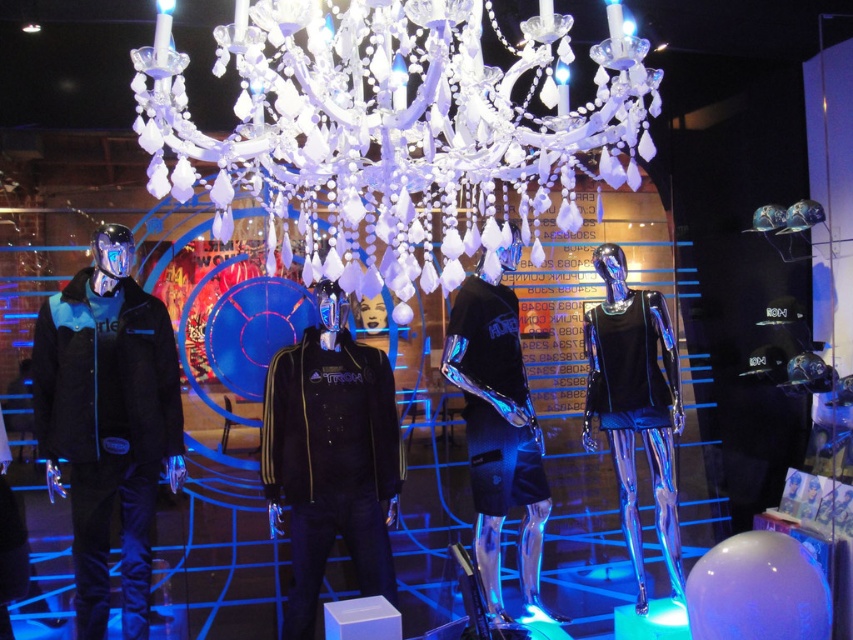
You are a customer in the store and want to take a photo of the black matte jacket at center. However, you want to avoid the crystal glass chandelier at upper center appearing in your shot. Based on their positions, is this possible?

The crystal glass chandelier at upper center is to the right of the black matte jacket at center, so if you position yourself to the left side of the jacket, you can frame the shot to exclude the chandelier.

You are standing in front of the futuristic retail display and want to touch the two points mentioned. Which point, point (415, 29) or point (373, 552), is closer to you?

Point (415, 29) is closer to the viewer than point (373, 552), so you can reach it first.

You are a fashion designer observing the futuristic retail display. You need to decide which item is shorter between the matte black jacket at left and the glossy black shorts at center. Which one should you choose?

The matte black jacket at left is not as tall as the glossy black shorts at center, so the matte black jacket at left is shorter.